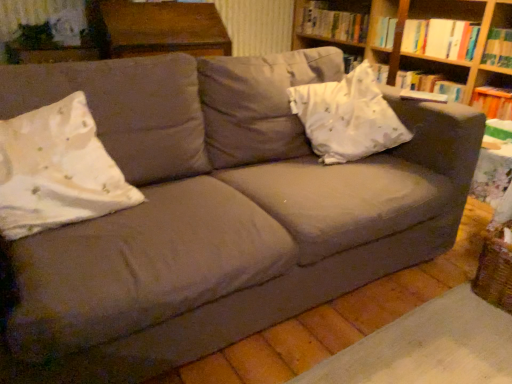
Question: Is point (508, 100) positioned closer to the camera than point (78, 110)?

Choices:
 (A) closer
 (B) farther

Answer: (B)

Question: Is hardcover book at right taller or shorter than white floral fabric pillow at left, which is the first throw pillow from front to back?

Choices:
 (A) short
 (B) tall

Answer: (A)

Question: Estimate the real-world distances between objects in this image. Which object is farther from the hardcover book at upper right, which ranks as the 1th book in back-to-front order?

Choices:
 (A) hardcover book at right
 (B) wooden bookshelf at upper right
 (C) white floral fabric pillow at left, placed as the second throw pillow when sorted from back to front
 (D) hardcover book at upper right, which is the 1th book from front to back
 (E) wooden table at upper center

Answer: (C)

Question: Based on their relative distances, which object is farther from the white satin pillow at upper right, the second throw pillow when ordered from front to back?

Choices:
 (A) wooden table at upper center
 (B) white floral fabric pillow at left, which is the first throw pillow from front to back
 (C) hardcover book at right
 (D) wooden bookshelf at upper right
 (E) hardcover book at upper right, which ranks as the second book in front-to-back order

Answer: (E)